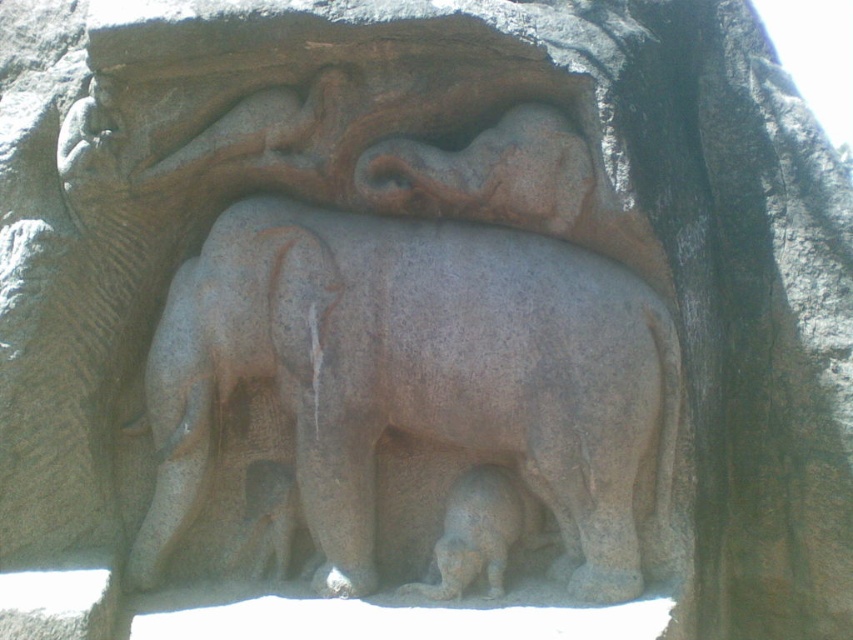
Is gray stone elephant at center below gray stone baby elephant at lower center?

Incorrect, gray stone elephant at center is not positioned below gray stone baby elephant at lower center.

Find the location of `gray stone elephant at center`. gray stone elephant at center is located at coordinates (416, 376).